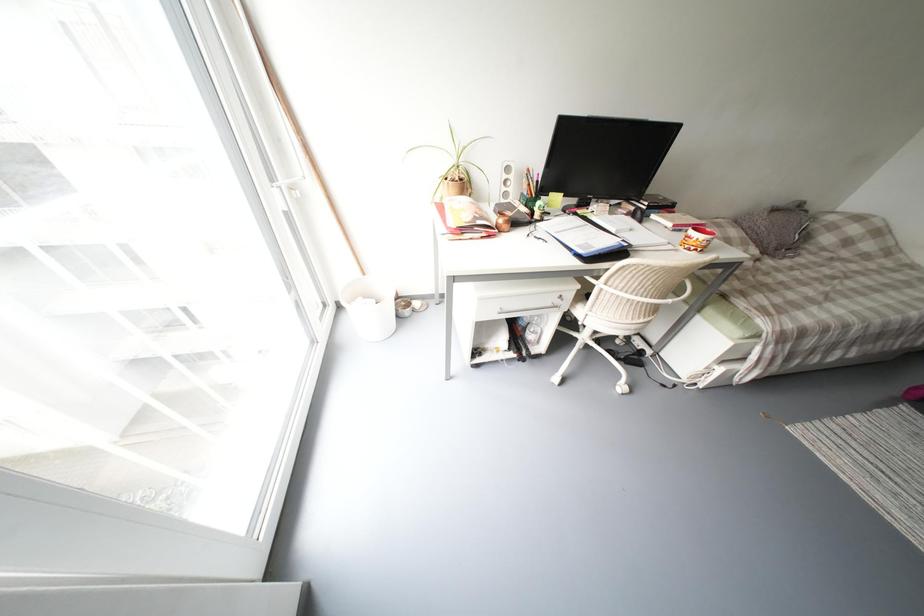
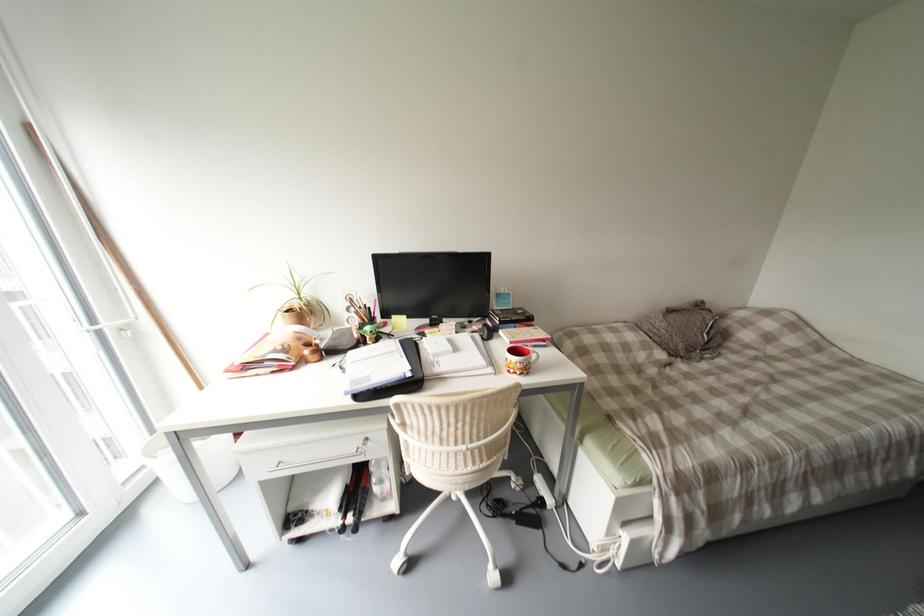
Question: The first image is from the beginning of the video and the second image is from the end. How did the camera likely rotate when shooting the video?

Choices:
 (A) Left
 (B) Right
 (C) Up
 (D) Down

Answer: (C)